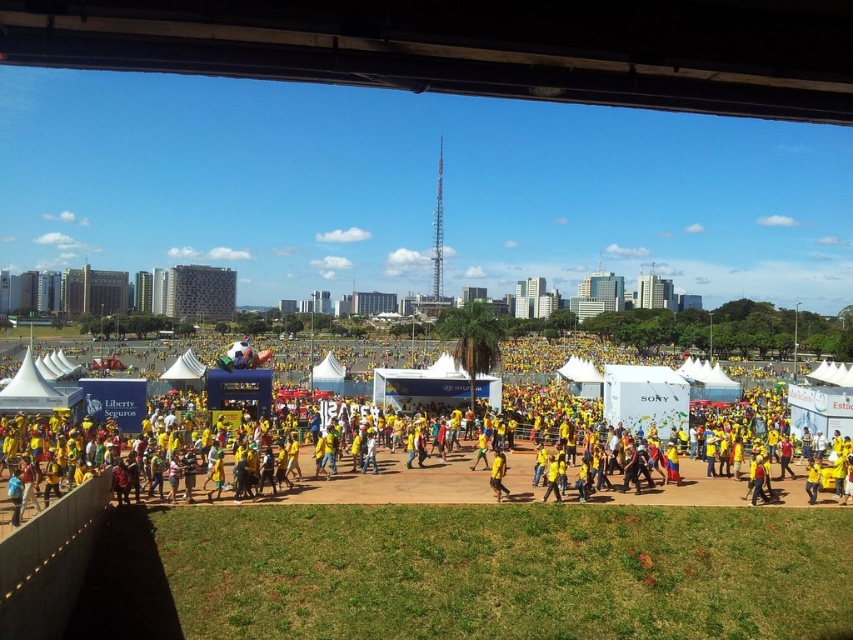
Does yellow fabric person at center appear over yellow matte shirt at center?

Yes, yellow fabric person at center is above yellow matte shirt at center.

Does yellow fabric person at center appear on the right side of yellow matte shirt at center?

Incorrect, yellow fabric person at center is not on the right side of yellow matte shirt at center.

The image size is (853, 640). Find the location of `yellow fabric person at center`. yellow fabric person at center is located at coordinates (137, 435).

Locate an element on the screen. yellow fabric person at center is located at coordinates (137, 435).